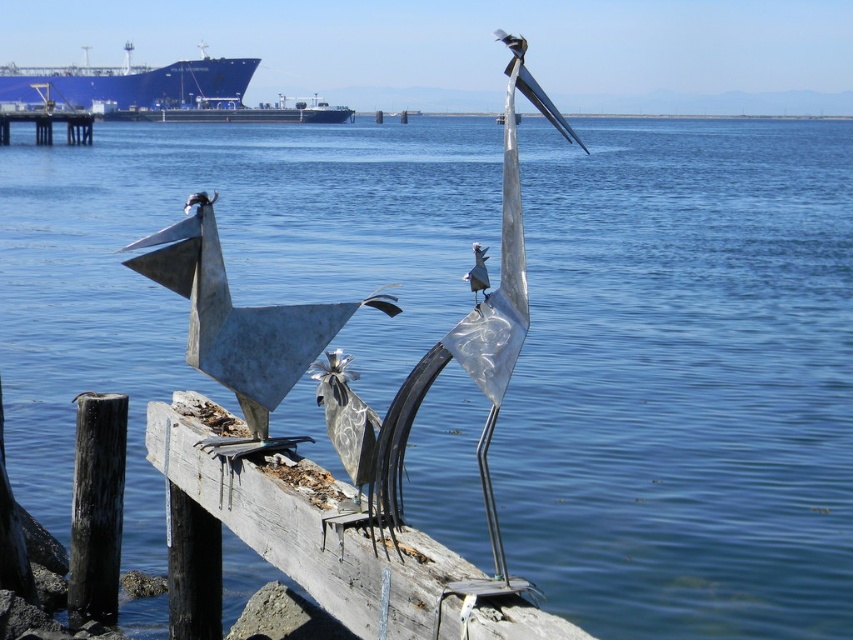
Question: Is blue metallic ship at upper center above brushed metal dock at left?

Choices:
 (A) yes
 (B) no

Answer: (A)

Question: Which of the following is the closest to the observer?

Choices:
 (A) (225, 99)
 (B) (207, 76)
 (C) (374, 513)
 (D) (49, 131)

Answer: (C)

Question: Observing the image, what is the correct spatial positioning of metallic silver crane at center in reference to blue metallic ship at upper center?

Choices:
 (A) above
 (B) below

Answer: (B)

Question: Among these points, which one is nearest to the camera?

Choices:
 (A) (520, 40)
 (B) (123, 120)

Answer: (A)

Question: Is the position of metallic silver crane at center more distant than that of brushed metal dock at left?

Choices:
 (A) yes
 (B) no

Answer: (B)

Question: Which is farther from the brushed metal dock at left?

Choices:
 (A) blue metallic ship at upper center
 (B) brushed metal ship at upper left

Answer: (A)